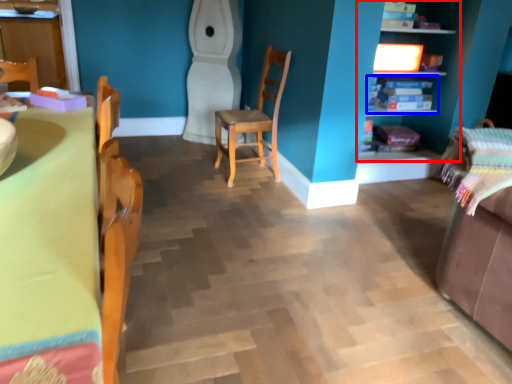
Question: Which point is closer to the camera, shelf (highlighted by a red box) or shelf (highlighted by a blue box)?

Choices:
 (A) shelf
 (B) shelf

Answer: (A)